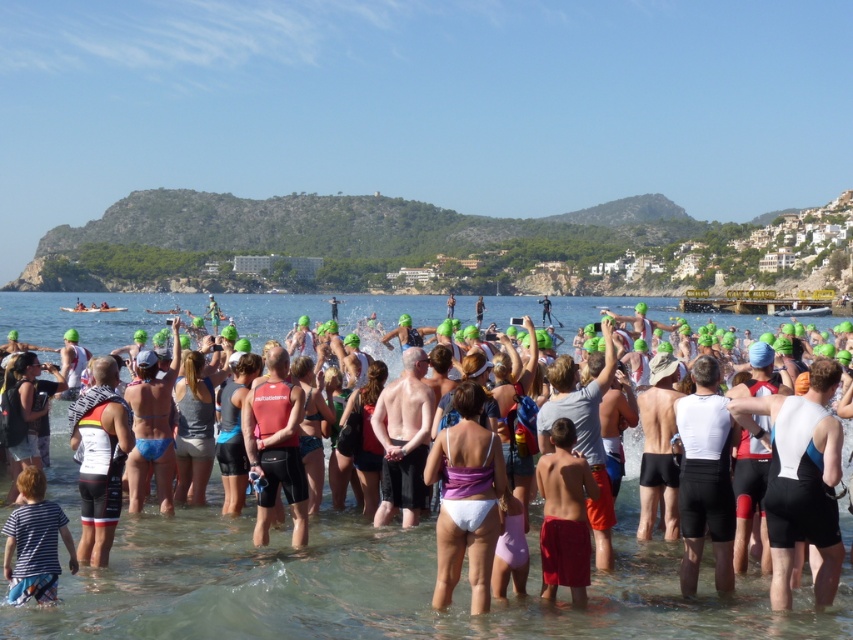
You are a photographer positioned at the starting line of the triathlon. You want to capture a photo that includes both the point at coordinates (560, 308) and the point at (589, 468). Which point will appear closer to the camera in the final photo?

Point at coordinates (560, 308) will appear closer to the camera in the photo because it is further to the viewer than point at coordinates (589, 468).

In the scene shown: You are a photographer positioned at the back of the crowd. You want to capture a photo of the purple fabric bikini at center and the striped cotton shirt at lower left without any overlap. Can you fit both in the frame if your camera has a 100cm field of view?

The purple fabric bikini at center might be wider than striped cotton shirt at lower left, but since the camera has a 100cm field of view, it depends on their actual widths. Without exact measurements, it is uncertain if both can fit without overlapping.